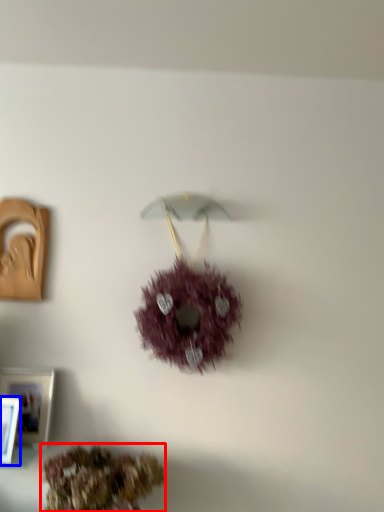
Question: Which object appears farthest to the camera in this image, flower (highlighted by a red box) or picture frame (highlighted by a blue box)?

Choices:
 (A) flower
 (B) picture frame

Answer: (B)